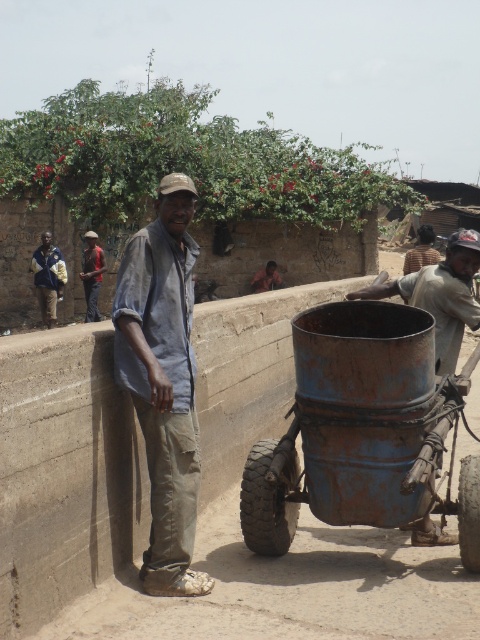
Question: Which object is the closest to the brown leather jacket at center?

Choices:
 (A) blue denim shirt at left
 (B) rusty metal wagon at center
 (C) rusty metal bucket at right
 (D) denim shirt at center

Answer: (A)

Question: From the image, what is the correct spatial relationship of blue denim shirt at left in relation to dark blue shirt at center?

Choices:
 (A) left
 (B) right

Answer: (A)

Question: Which point is farther to the camera?

Choices:
 (A) rusty metal wagon at center
 (B) blue denim shirt at left

Answer: (B)

Question: Is denim shirt at center smaller than dark blue shirt at center?

Choices:
 (A) no
 (B) yes

Answer: (A)

Question: Does blue denim shirt at left have a greater width compared to brown leather jacket at center?

Choices:
 (A) no
 (B) yes

Answer: (B)

Question: Which of the following is the closest to the observer?

Choices:
 (A) (435, 304)
 (B) (158, 324)
 (C) (96, 234)
 (D) (46, 324)

Answer: (B)